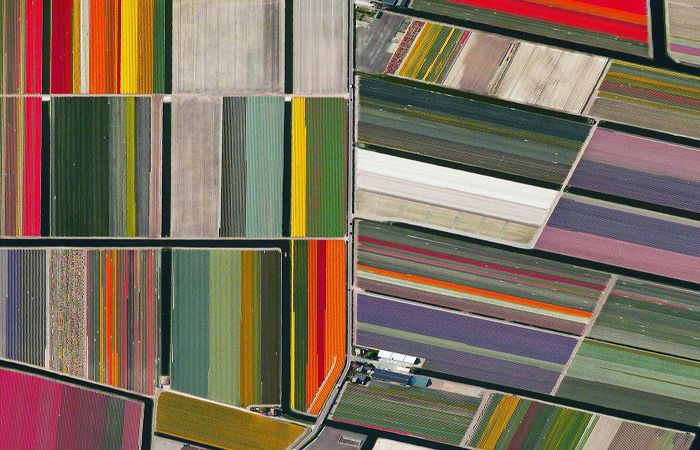
What are the coordinates of `red, green, and pink vertical striped corner of rug` in the screenshot? It's located at (47, 422).